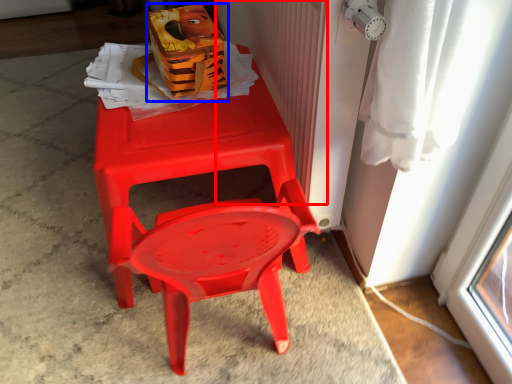
Question: Among these objects, which one is nearest to the camera, radiator (highlighted by a red box) or lunch box (highlighted by a blue box)?

Choices:
 (A) radiator
 (B) lunch box

Answer: (A)